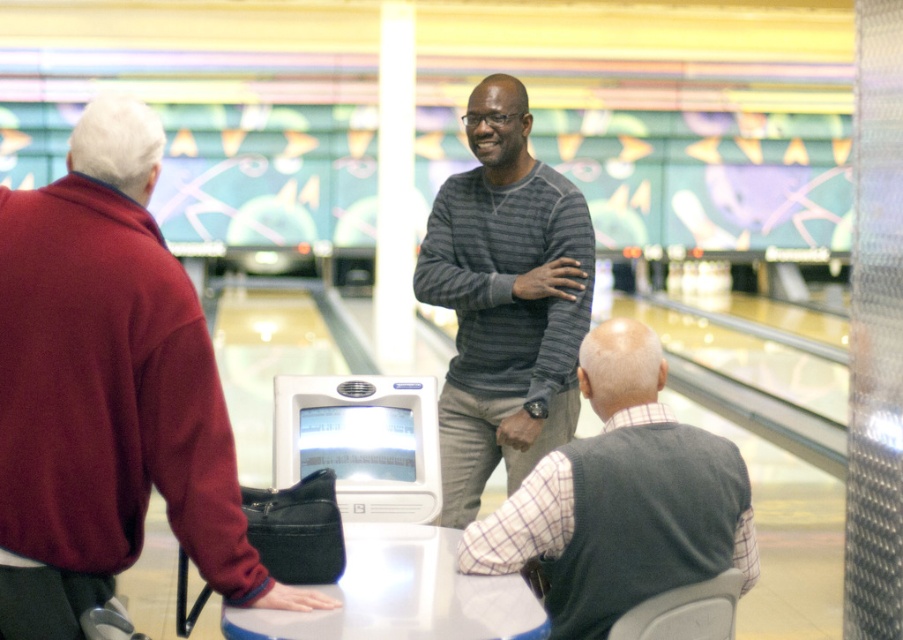
Question: Is striped sweater at center smaller than gray sweater at center?

Choices:
 (A) no
 (B) yes

Answer: (A)

Question: Based on their relative distances, which object is nearer to the maroon sweater at center?

Choices:
 (A) striped sweater at center
 (B) gray sweater at center

Answer: (B)

Question: Observing the image, what is the correct spatial positioning of maroon sweater at center in reference to striped sweater at center?

Choices:
 (A) left
 (B) right

Answer: (A)

Question: Which of these objects is positioned farthest from the gray sweater at center?

Choices:
 (A) striped sweater at center
 (B) maroon sweater at center

Answer: (A)

Question: Can you confirm if maroon sweater at center is positioned below striped sweater at center?

Choices:
 (A) no
 (B) yes

Answer: (B)

Question: Among these objects, which one is nearest to the camera?

Choices:
 (A) gray sweater at center
 (B) striped sweater at center
 (C) maroon sweater at center

Answer: (C)